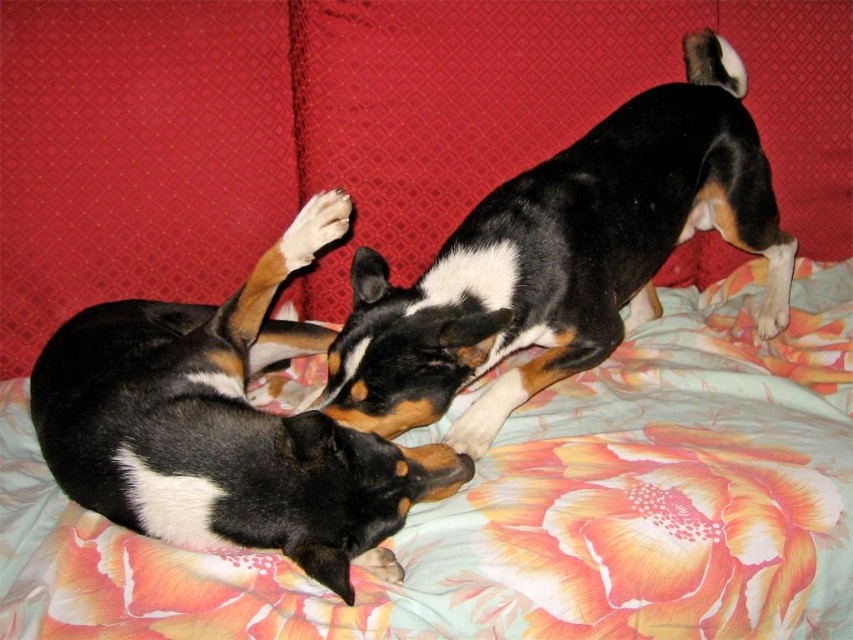
You are a veterinarian examining a dog lying on a floral bed. You see the black and white fur at center and the white soft paw at center. Which part of the dog is wider?

The black and white fur at center is wider than the white soft paw at center.

You are a pet sitter who needs to clean the bedspread. Can you tell me which object is on top of the other? Specifically, is the floral fabric bedspread at center above or below the black and white fur at center?

The floral fabric bedspread at center is positioned under the black and white fur at center, so the black and white fur at center is on top of the bedspread.

You are a pet sitter observing two dogs on a bed. The dogs are labeled as black and white fur at upper center and black and white fur at center. Which dog is taller?

The black and white fur at upper center is taller than the black and white fur at center.